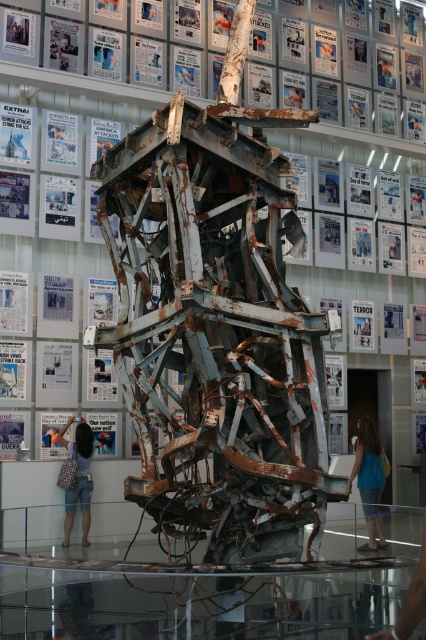
Is blue denim jeans at lower right to the left of white glossy poster at upper center from the viewer's perspective?

In fact, blue denim jeans at lower right is to the right of white glossy poster at upper center.

Does blue denim jeans at lower right have a greater width compared to white glossy poster at upper center?

Yes, blue denim jeans at lower right is wider than white glossy poster at upper center.

Identify the location of blue denim jeans at lower right. (370, 481).

Identify the location of blue denim jeans at lower right. Image resolution: width=426 pixels, height=640 pixels. (370, 481).

Is rusty metal sculpture at center bigger than white glossy poster at upper center?

No.

Is point (25, 93) farther from camera compared to point (143, 3)?

No, (25, 93) is in front of (143, 3).

Is point (22, 260) closer to camera compared to point (150, 10)?

Yes.

At what (x,y) coordinates should I click in order to perform the action: click on rusty metal sculpture at center. Please return your answer as a coordinate pair (x, y). This screenshot has height=640, width=426. Looking at the image, I should click on (350, 145).

Who is more forward, (94, 268) or (360, 440)?

Positioned in front is point (360, 440).

Does rusty metal sculpture at center appear on the right side of blue denim jeans at lower right?

Incorrect, rusty metal sculpture at center is not on the right side of blue denim jeans at lower right.

Locate an element on the screen. rusty metal sculpture at center is located at coordinates (350, 145).

Image resolution: width=426 pixels, height=640 pixels. Identify the location of rusty metal sculpture at center. (350, 145).